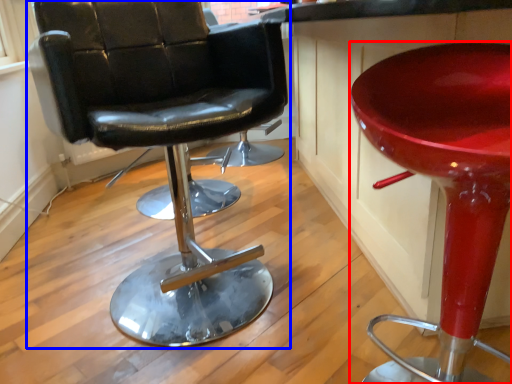
Question: Which object is further to the camera taking this photo, stool (highlighted by a red box) or chair (highlighted by a blue box)?

Choices:
 (A) stool
 (B) chair

Answer: (B)